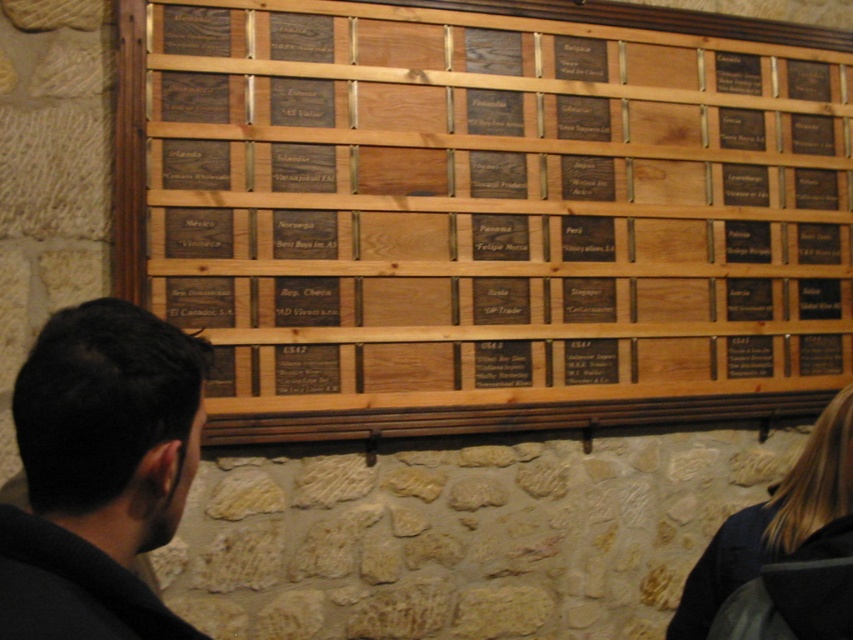
Question: Is black wood plaque at center further to the viewer compared to blonde hair at lower right?

Choices:
 (A) yes
 (B) no

Answer: (A)

Question: Where is black wood plaque at center located in relation to blonde hair at lower right in the image?

Choices:
 (A) above
 (B) below

Answer: (A)

Question: Does black wood plaque at center appear under dark brown hair at center?

Choices:
 (A) no
 (B) yes

Answer: (A)

Question: Which object appears farthest from the camera in this image?

Choices:
 (A) blonde hair at lower right
 (B) dark brown hair at center
 (C) black wood plaque at center

Answer: (C)

Question: Which point is farther from the camera taking this photo?

Choices:
 (A) click(x=683, y=625)
 (B) click(x=618, y=182)
 (C) click(x=86, y=412)

Answer: (B)

Question: Which point is closer to the camera taking this photo?

Choices:
 (A) [x=708, y=582]
 (B) [x=64, y=625]
 (C) [x=495, y=234]

Answer: (B)